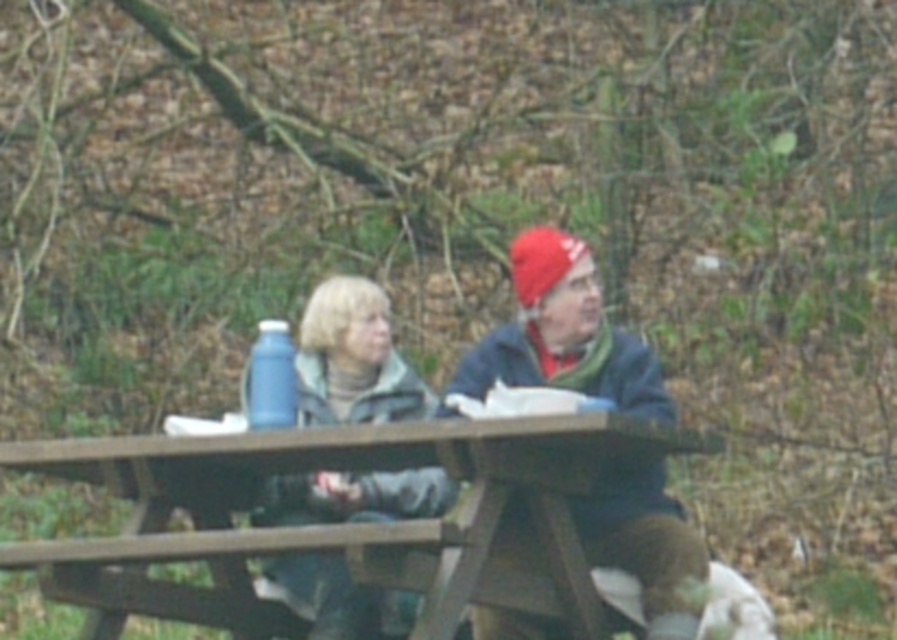
Question: Which object is the farthest from the matte gray jacket at center?

Choices:
 (A) matte blue thermos at center
 (B) wooden picnic table at center

Answer: (A)

Question: Which object appears farthest from the camera in this image?

Choices:
 (A) wooden picnic table at center
 (B) matte gray jacket at center
 (C) matte blue thermos at center
 (D) blue plastic bottle at center

Answer: (B)

Question: In this image, where is wooden picnic table at center located relative to blue plastic bottle at center?

Choices:
 (A) right
 (B) left

Answer: (A)

Question: Estimate the real-world distances between objects in this image. Which object is farther from the matte gray jacket at center?

Choices:
 (A) matte blue thermos at center
 (B) wooden picnic table at center

Answer: (A)

Question: Can you confirm if matte blue thermos at center is positioned to the left of blue plastic bottle at center?

Choices:
 (A) no
 (B) yes

Answer: (A)

Question: Is wooden picnic table at center in front of blue plastic bottle at center?

Choices:
 (A) no
 (B) yes

Answer: (B)